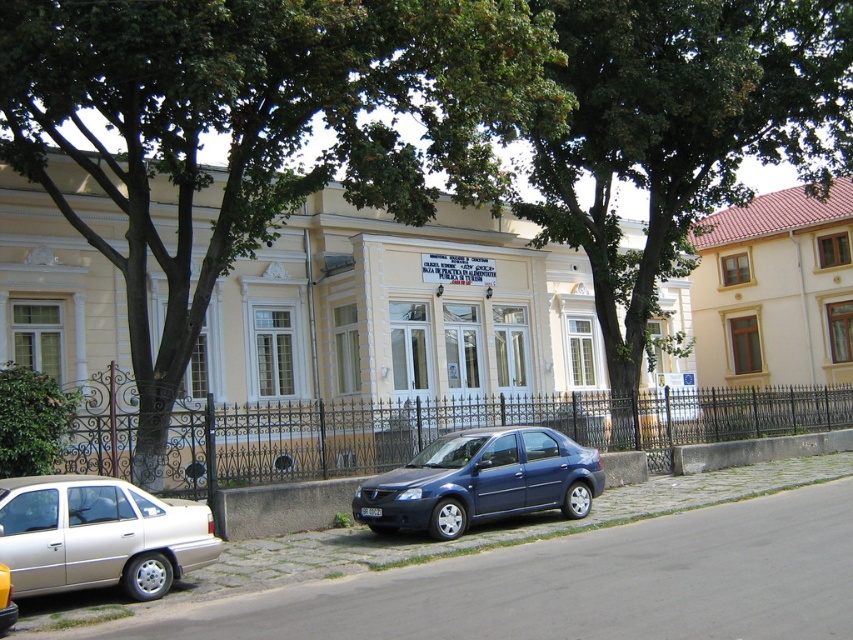
Looking at this image, you are a pedestrian standing on the sidewalk and want to cross the street to reach the central building. Which object must you step over or move past first, the green leafy tree at upper center or the gray concrete curb at lower center?

You must step over or move past the gray concrete curb at lower center first because it is closer to you than the green leafy tree at upper center, which is behind it.

You are a pedestrian standing on the sidewalk next to the street. You see the green leafy tree at upper center and the satin blue sedan at center. Which object is higher in the image?

The green leafy tree at upper center is higher in the image than the satin blue sedan at center.

You are a pedestrian standing on the sidewalk and want to cross the street to the central building. The gray concrete curb at lower center is in your way. Which direction should you move to avoid the green leafy tree at upper center and reach the curb safely?

You should move to the right to avoid the green leafy tree at upper center, as it is on the left side of the gray concrete curb at lower center, allowing you to reach the curb safely.